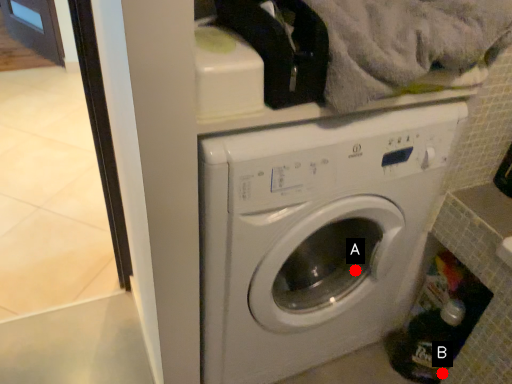
Question: Two points are circled on the image, labeled by A and B beside each circle. Which point is farther from the camera taking this photo?

Choices:
 (A) A is further
 (B) B is further

Answer: (B)